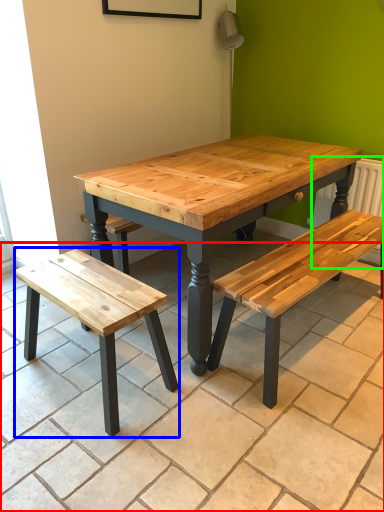
Question: Estimate the real-world distances between objects in this image. Which object is farther from tile (highlighted by a red box), bench (highlighted by a blue box) or radiator (highlighted by a green box)?

Choices:
 (A) bench
 (B) radiator

Answer: (B)